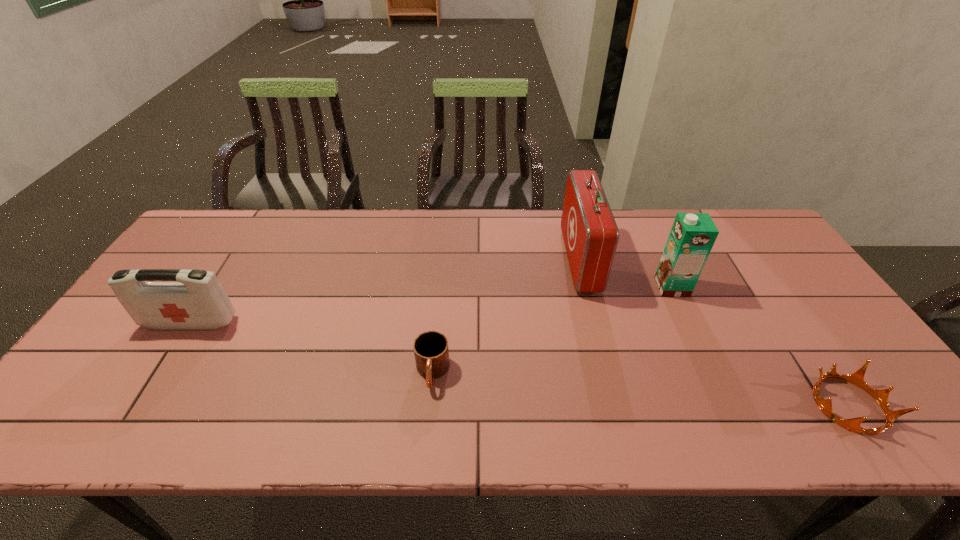
Identify the location of free space between the rightmost object and the fourth object from right to left. Image resolution: width=960 pixels, height=540 pixels. (640, 389).

Identify the location of blank region between the taller first-aid kit and the crown. This screenshot has height=540, width=960. (714, 333).

Where is `vacant area that lies between the fourth object from left to right and the crown`? Image resolution: width=960 pixels, height=540 pixels. vacant area that lies between the fourth object from left to right and the crown is located at coordinates (760, 346).

The image size is (960, 540). What are the coordinates of `free spot between the second object from left to right and the second object from right to left` in the screenshot? It's located at (552, 330).

Identify which object is the fourth nearest to the taller first-aid kit. Please provide its 2D coordinates. Your answer should be formatted as a tuple, i.e. [(x, y)], where the tuple contains the x and y coordinates of a point satisfying the conditions above.

[(198, 301)]

Choose which object is the second nearest neighbor to the third shortest object. Please provide its 2D coordinates. Your answer should be formatted as a tuple, i.e. [(x, y)], where the tuple contains the x and y coordinates of a point satisfying the conditions above.

[(590, 233)]

At what (x,y) coordinates should I click in order to perform the action: click on free location that satisfies the following two spatial constraints: 1. on the side of the rightmost object with the first aid cross symbol; 2. on the left side of the taller first-aid kit. Please return your answer as a coordinate pair (x, y). Looking at the image, I should click on point(616,405).

Find the location of a particular element. The height and width of the screenshot is (540, 960). free spot that satisfies the following two spatial constraints: 1. on the back side of the crown; 2. on the side of the taller first-aid kit with the first aid cross symbol is located at coordinates (750, 260).

In order to click on free space that satisfies the following two spatial constraints: 1. on the side of the carton with the first aid cross symbol; 2. on the right side of the third object from right to left in this screenshot , I will do `click(587, 287)`.

You are a GUI agent. You are given a task and a screenshot of the screen. Output one action in this format:
    pyautogui.click(x=<x>, y=<y>)
    Task: Click on the vacant space that satisfies the following two spatial constraints: 1. on the side of the taller first-aid kit with the first aid cross symbol; 2. on the side of the mug with the handle
    This screenshot has height=540, width=960.
    Given the screenshot: What is the action you would take?
    pyautogui.click(x=609, y=373)